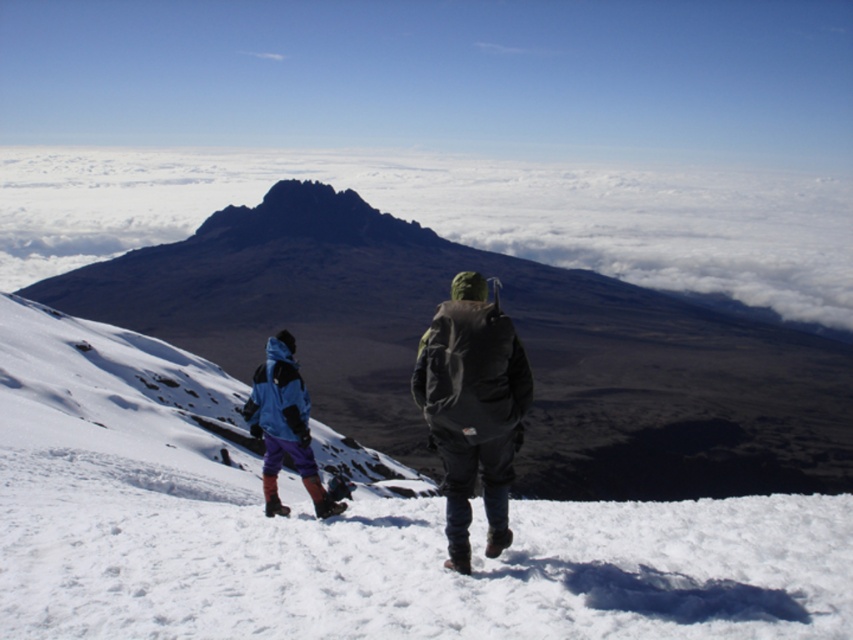
You are planning to take a photo of the dark gray rocky peak at center and the blue fleece jacket at lower left from your current position. Which object will appear larger in the photo?

The dark gray rocky peak at center appears larger in the photo because it is closer to the camera than the blue fleece jacket at lower left.

You are a drone operator tasked with capturing aerial footage of two hikers in a snowy landscape. The hikers are located at point (234,211). Your drone has a maximum range of 500 meters. Can you fly the drone from one hiker to the other without exceeding its range?

The two hikers are 510.62 meters apart, which exceeds the drone maximum range of 500 meters. Therefore, the drone cannot fly between them without exceeding its range.

You are standing at the base of the mountain and see two points marked in the snowy landscape. Which point, point [469,552] or point [248,429], is closer to you?

Point [469,552] is closer to the viewer than point [248,429].